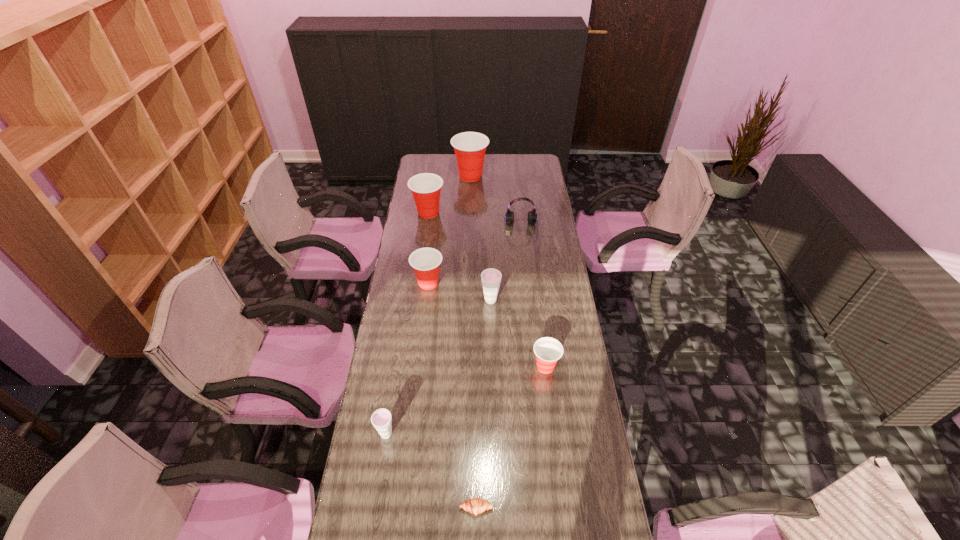
Where is `vacant space that is in between the nearest red cup and the second nearest object`? This screenshot has width=960, height=540. vacant space that is in between the nearest red cup and the second nearest object is located at coordinates (466, 400).

You are a GUI agent. You are given a task and a screenshot of the screen. Output one action in this format:
    pyautogui.click(x=<x>, y=<y>)
    Task: Click on the free spot between the pastry and the right purple cup
    The height and width of the screenshot is (540, 960).
    Given the screenshot: What is the action you would take?
    pyautogui.click(x=484, y=404)

Find the location of a particular element. empty location between the third farthest red cup and the sixth farthest object is located at coordinates tap(487, 325).

Locate an element on the screen. The width and height of the screenshot is (960, 540). free space between the pastry and the tallest cup is located at coordinates (473, 342).

You are a GUI agent. You are given a task and a screenshot of the screen. Output one action in this format:
    pyautogui.click(x=<x>, y=<y>)
    Task: Click on the free space between the second smallest red cup and the farther purple cup
    This screenshot has height=540, width=960.
    Given the screenshot: What is the action you would take?
    pyautogui.click(x=460, y=292)

Select which object is the fourth closest to the farthest cup. Please provide its 2D coordinates. Your answer should be formatted as a tuple, i.e. [(x, y)], where the tuple contains the x and y coordinates of a point satisfying the conditions above.

[(491, 278)]

Identify the location of the fifth closest object to the third biggest red cup. (381, 419).

Identify which cup is the second nearest to the tallest cup. Please provide its 2D coordinates. Your answer should be formatted as a tuple, i.e. [(x, y)], where the tuple contains the x and y coordinates of a point satisfying the conditions above.

[(425, 261)]

Find the location of a particular element. This screenshot has height=540, width=960. the fourth closest cup relative to the nearer purple cup is located at coordinates (425, 187).

Identify the location of red cup that is the second closest to the second tallest object. The height and width of the screenshot is (540, 960). (425, 261).